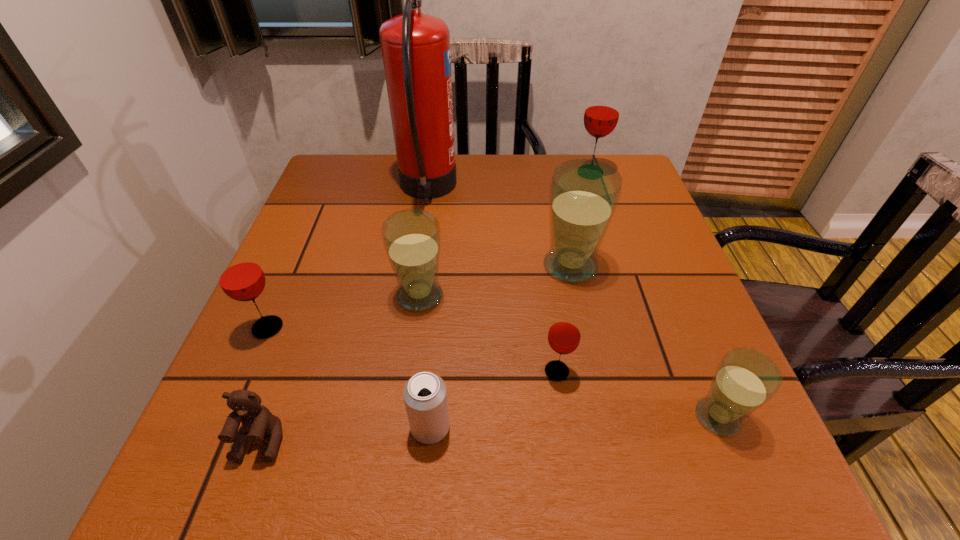
You are a GUI agent. You are given a task and a screenshot of the screen. Output one action in this format:
    pyautogui.click(x=<x>, y=<y>)
    Task: Click on the free spot located on the left of the smallest red glass
    Image resolution: width=960 pixels, height=540 pixels.
    Given the screenshot: What is the action you would take?
    pyautogui.click(x=365, y=372)

The width and height of the screenshot is (960, 540). Identify the location of free space located 0.370m on the left of the nearest glass. (464, 417).

Identify the location of free point located 0.390m on the back of the white beer can. (445, 251).

Locate an element on the screen. This screenshot has height=540, width=960. fire extinguisher located at the far edge is located at coordinates (415, 47).

Locate an element on the screen. The width and height of the screenshot is (960, 540). glass at the far edge is located at coordinates (602, 111).

I want to click on glass that is at the near edge, so click(x=745, y=379).

This screenshot has width=960, height=540. Find the location of `beer can present at the near edge`. beer can present at the near edge is located at coordinates coord(425,396).

Find the location of a particular element. The height and width of the screenshot is (540, 960). teddy bear that is at the near edge is located at coordinates (257, 421).

Find the location of a particular element. This screenshot has height=540, width=960. glass that is at the left edge is located at coordinates (240, 276).

Locate an element on the screen. The height and width of the screenshot is (540, 960). teddy bear positioned at the left edge is located at coordinates pos(257,421).